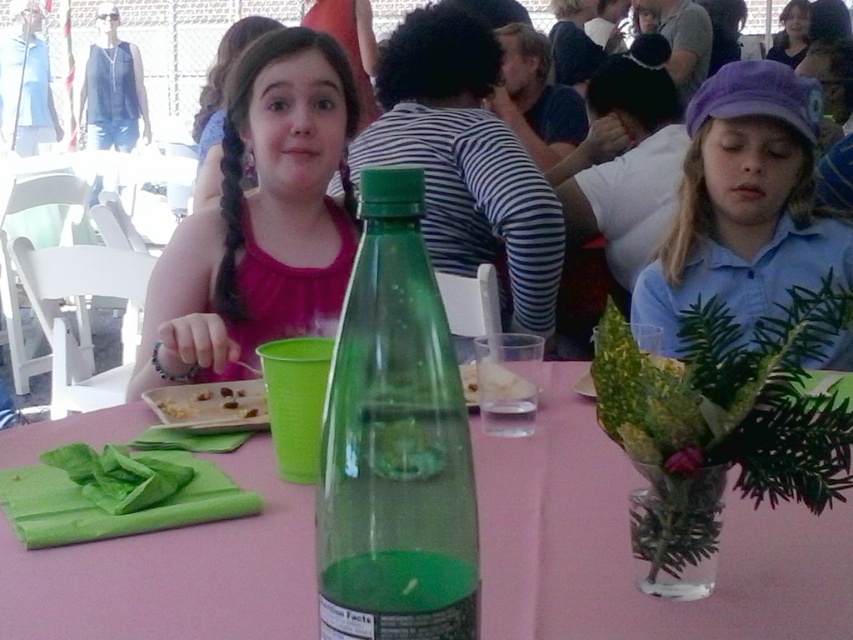
You are a caterer setting up for a party. You have two bottles, the transparent glass bottle at center and the green translucent bottle at center, placed on a table. You need to place a decorative centerpiece between them. What is the minimum distance the centerpiece should occupy between them to fit properly?

The transparent glass bottle at center and green translucent bottle at center are 12.43 inches apart from each other. Therefore, the minimum distance the centerpiece should occupy between them is 12.43 inches to fit properly.

You are at a party and want to pour juice into the transparent glass bottle at center. You notice a matte black shirt at upper right nearby. Can the bottle fit under the shirt without touching it?

The transparent glass bottle at center has a lesser height compared to matte black shirt at upper right, so yes, the bottle can fit under the shirt without touching it.